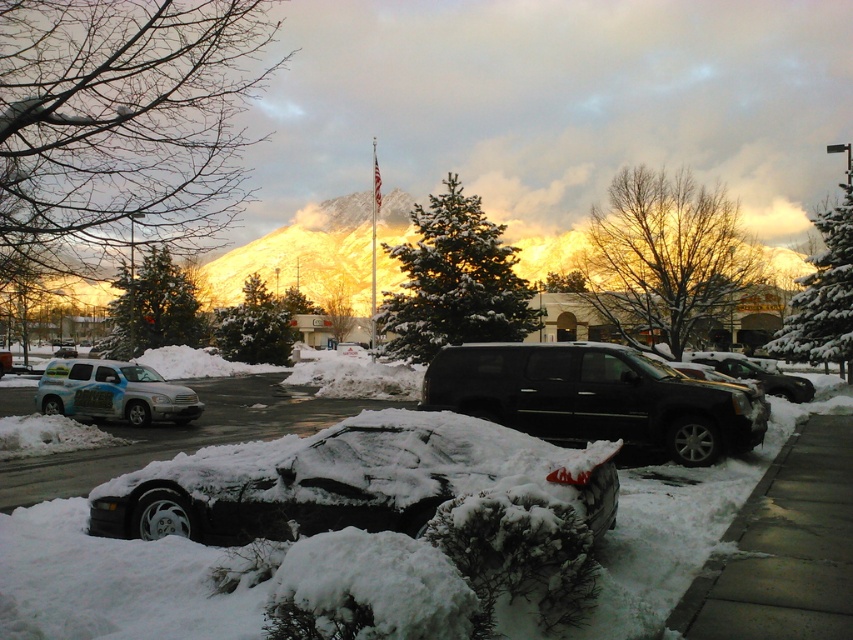
Question: Can you confirm if black matte suv at center is smaller than snow-covered asphalt at lower center?

Choices:
 (A) no
 (B) yes

Answer: (B)

Question: Among these points, which one is farthest from the camera?

Choices:
 (A) (763, 369)
 (B) (828, 538)
 (C) (71, 412)

Answer: (A)

Question: Does snow-covered sedan at center have a greater width compared to shiny black suv at right?

Choices:
 (A) yes
 (B) no

Answer: (A)

Question: Based on their relative distances, which object is farther from the black matte suv at center?

Choices:
 (A) snow-covered sedan at center
 (B) snow-covered asphalt at lower center
 (C) matte metallic suv at left

Answer: (C)

Question: Does snow-covered sedan at center come behind snow-covered asphalt at lower center?

Choices:
 (A) no
 (B) yes

Answer: (A)

Question: Which of the following is the closest to the observer?

Choices:
 (A) (698, 451)
 (B) (277, 499)
 (C) (846, 595)
 (D) (61, 406)

Answer: (C)